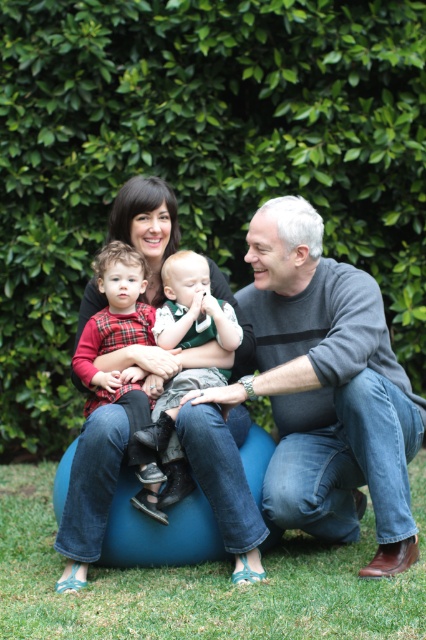
You are planning to place a new rectangular table that is 1.5 meters wide between the green leafy hedge at upper center and the blue fabric bean bag at center. Based on the scene description, will the table fit between them without overlapping either object?

The green leafy hedge at upper center is wider than the blue fabric bean bag at center. Since the table is 1.5 meters wide, but the exact distance between them isn not provided, it is uncertain if the table will fit without overlapping. More information is needed about the space between the two objects.

You are a photographer setting up a family portrait. You want to ensure that the blue fabric bean bag at center is visible in the photo without being blocked by the green leafy hedge at upper center. Based on the scene, can you confirm if this is possible?

The green leafy hedge at upper center is much taller than the blue fabric bean bag at center, so the hedge may block the view of the bean bag if not positioned carefully. To ensure visibility, position the camera lower or move the bean bag closer to the foreground.

You are a photographer trying to capture a family portrait. You want to ensure the green leafy hedge at upper center and the plaid fabric baby at center are both visible. Which object should you focus on to make sure both are in frame?

The green leafy hedge at upper center is bigger than the plaid fabric baby at center, so focusing on the larger object, the green leafy hedge at upper center, will help ensure both are in frame.